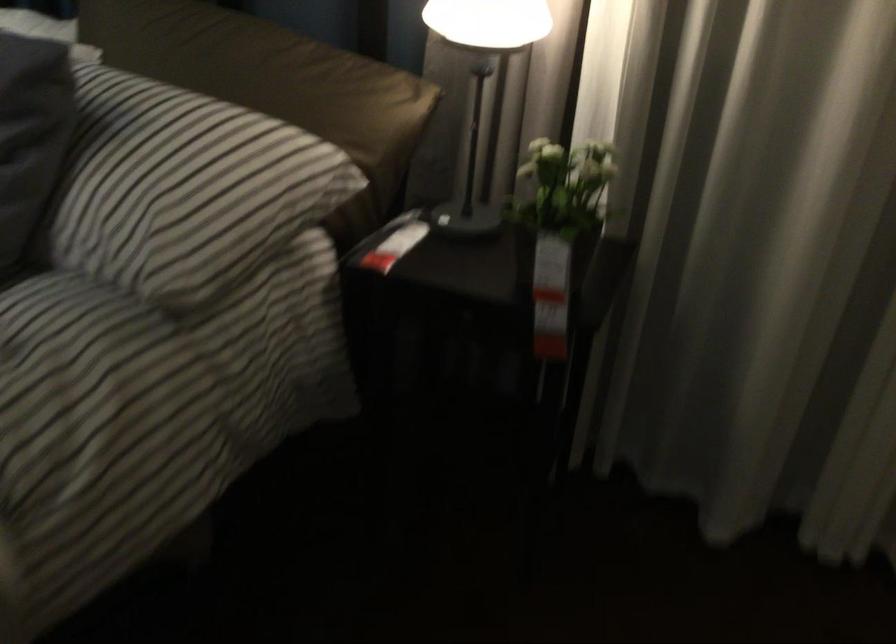
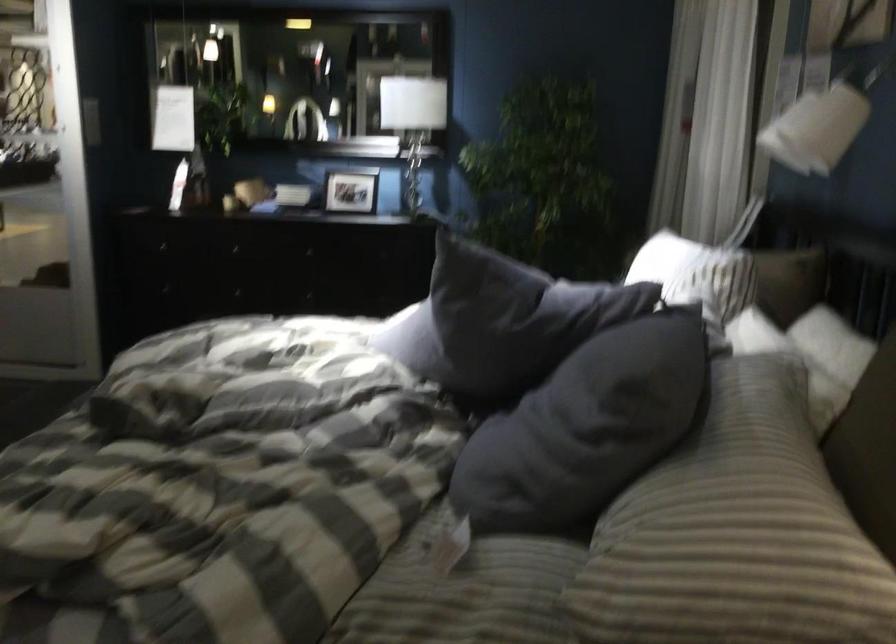
The point at (174, 108) is marked in the first image. Where is the corresponding point in the second image?

(760, 453)